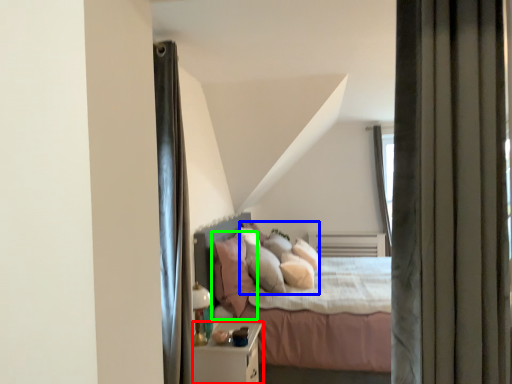
Question: Based on their relative distances, which object is nearer to nightstand (highlighted by a red box)? Choose from pillow (highlighted by a blue box) and pillow (highlighted by a green box).

Choices:
 (A) pillow
 (B) pillow

Answer: (B)